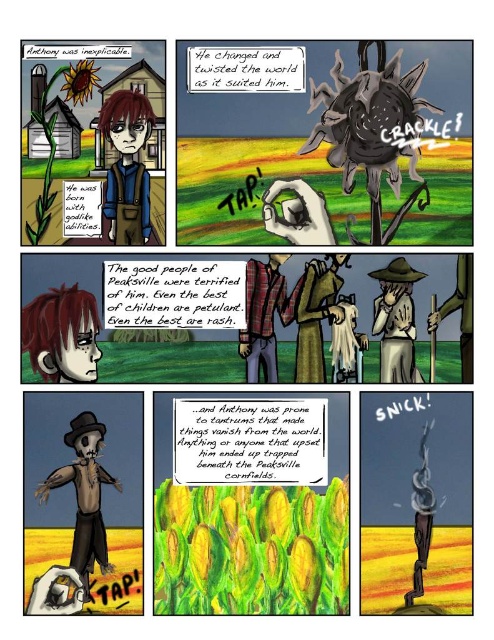
Is matte brown hair at center behind brown straw hat at center?

No, it is in front of brown straw hat at center.

Is point (130, 188) farther from viewer compared to point (408, 292)?

Yes, point (130, 188) is farther from viewer.

Which is behind, point (111, 115) or point (393, 289)?

Point (393, 289)

Where is `matte brown hair at center`? Image resolution: width=494 pixels, height=640 pixels. matte brown hair at center is located at coordinates (126, 166).

Does dark gray metallic flower at upper center have a smaller size compared to plaid fabric shirt at center?

No, dark gray metallic flower at upper center is not smaller than plaid fabric shirt at center.

Is dark gray metallic flower at upper center below plaid fabric shirt at center?

No, dark gray metallic flower at upper center is not below plaid fabric shirt at center.

Where is `dark gray metallic flower at upper center`? dark gray metallic flower at upper center is located at coordinates (324, 141).

The height and width of the screenshot is (640, 494). Describe the element at coordinates (324, 141) in the screenshot. I see `dark gray metallic flower at upper center` at that location.

Consider the image. Between dark gray metallic flower at upper center and brown straw hat at center, which one has more height?

dark gray metallic flower at upper center

Locate an element on the screen. Image resolution: width=494 pixels, height=640 pixels. dark gray metallic flower at upper center is located at coordinates [324, 141].